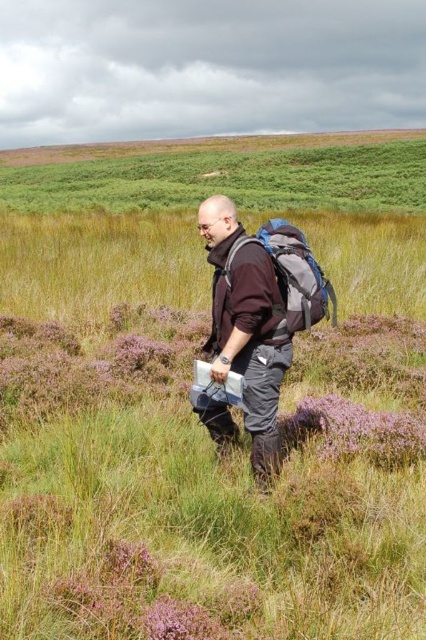
Where is the matte black jacket at center located in the image?

The matte black jacket at center is located at point coordinates of [247,326].